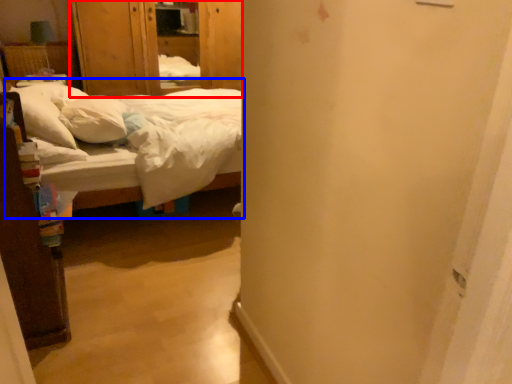
Question: Among these objects, which one is nearest to the camera, armoire (highlighted by a red box) or bed (highlighted by a blue box)?

Choices:
 (A) armoire
 (B) bed

Answer: (B)